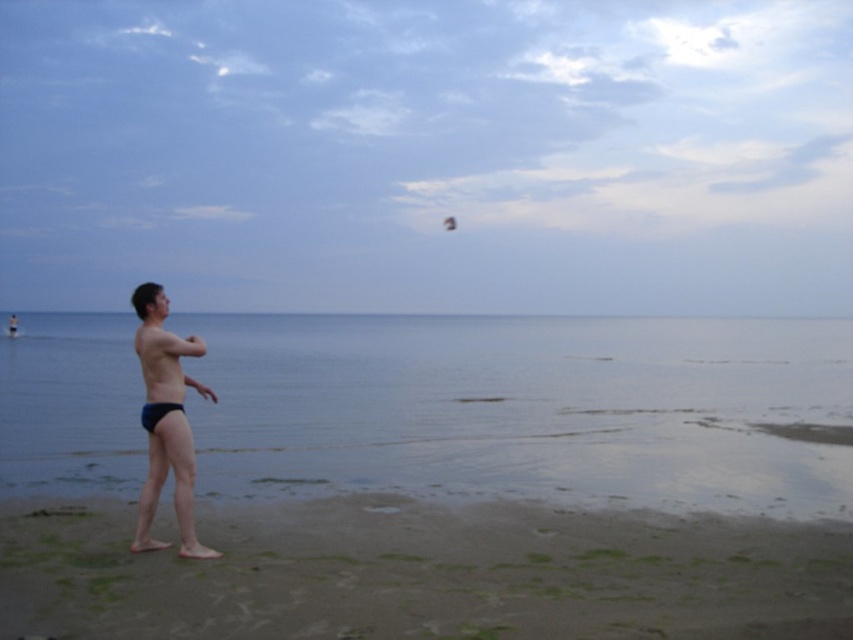
Question: Considering the real-world distances, which object is closest to the dark blue swim trunks at left?

Choices:
 (A) clear blue water at lower left
 (B) brown sandy beach at lower center

Answer: (B)

Question: Estimate the real-world distances between objects in this image. Which object is farther from the brown sandy beach at lower center?

Choices:
 (A) clear blue water at lower left
 (B) dark blue swim trunks at left

Answer: (A)

Question: Which point appears farthest from the camera in this image?

Choices:
 (A) (625, 477)
 (B) (160, 388)
 (C) (711, 529)

Answer: (A)

Question: Does clear blue water at lower left have a larger size compared to brown sandy beach at lower center?

Choices:
 (A) no
 (B) yes

Answer: (B)

Question: Is clear blue water at lower left bigger than dark blue swim trunks at left?

Choices:
 (A) no
 (B) yes

Answer: (B)

Question: Is brown sandy beach at lower center bigger than dark blue swim trunks at left?

Choices:
 (A) yes
 (B) no

Answer: (B)